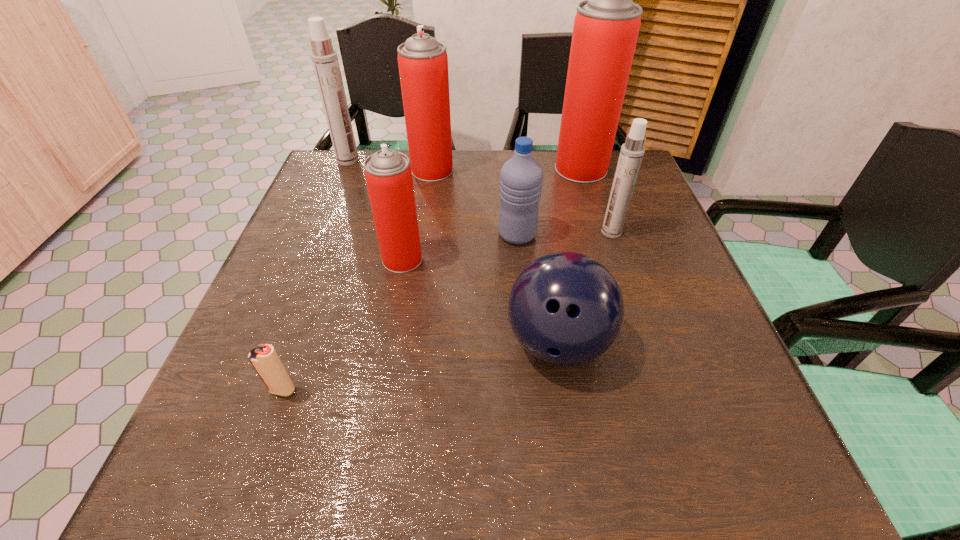
In order to click on vacant space situated 0.050m on the front of the igniter in this screenshot , I will do `click(270, 427)`.

Locate an element on the screen. The width and height of the screenshot is (960, 540). aerosol can located at the left edge is located at coordinates coord(325,61).

The image size is (960, 540). In order to click on igniter located at the left edge in this screenshot , I will do `click(265, 360)`.

At what (x,y) coordinates should I click in order to perform the action: click on object present at the far left corner. Please return your answer as a coordinate pair (x, y). This screenshot has height=540, width=960. Looking at the image, I should click on (325, 61).

The image size is (960, 540). Identify the location of object that is at the far right corner. [x=606, y=26].

Image resolution: width=960 pixels, height=540 pixels. In the image, there is a desktop. What are the coordinates of `free space at the far edge` in the screenshot? It's located at (492, 174).

Find the location of a particular element. vacant position at the near edge of the desktop is located at coordinates click(406, 436).

Image resolution: width=960 pixels, height=540 pixels. In the image, there is a desktop. Identify the location of free region at the left edge. (300, 393).

What are the coordinates of `free region at the right edge of the desktop` in the screenshot? It's located at (667, 362).

This screenshot has width=960, height=540. What are the coordinates of `vacant space at the far left corner of the desktop` in the screenshot? It's located at (332, 185).